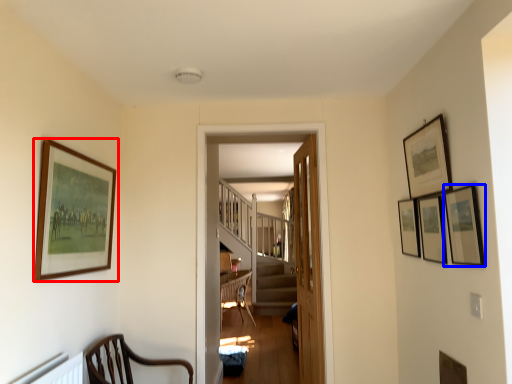
Question: Which object appears farthest to the camera in this image, picture frame (highlighted by a red box) or picture frame (highlighted by a blue box)?

Choices:
 (A) picture frame
 (B) picture frame

Answer: (A)